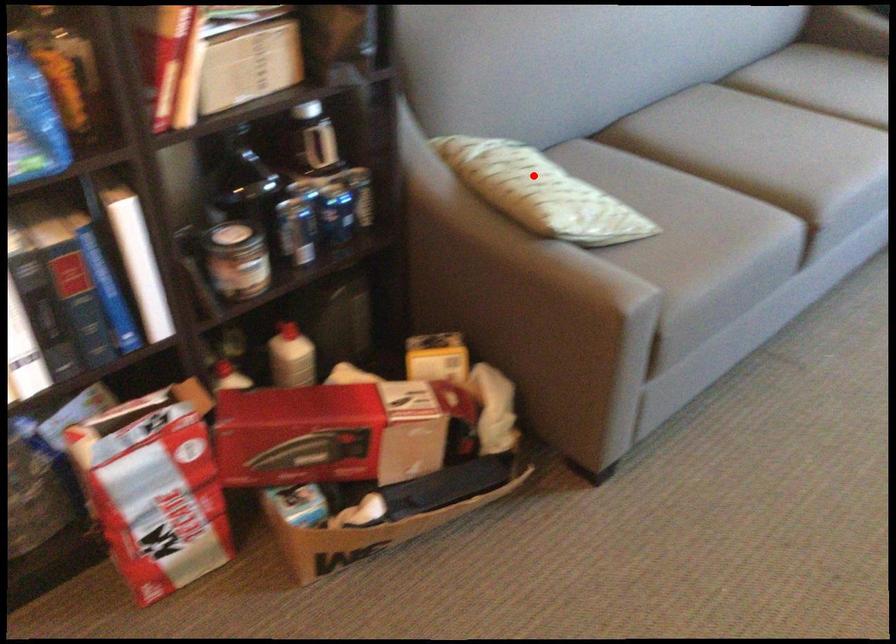
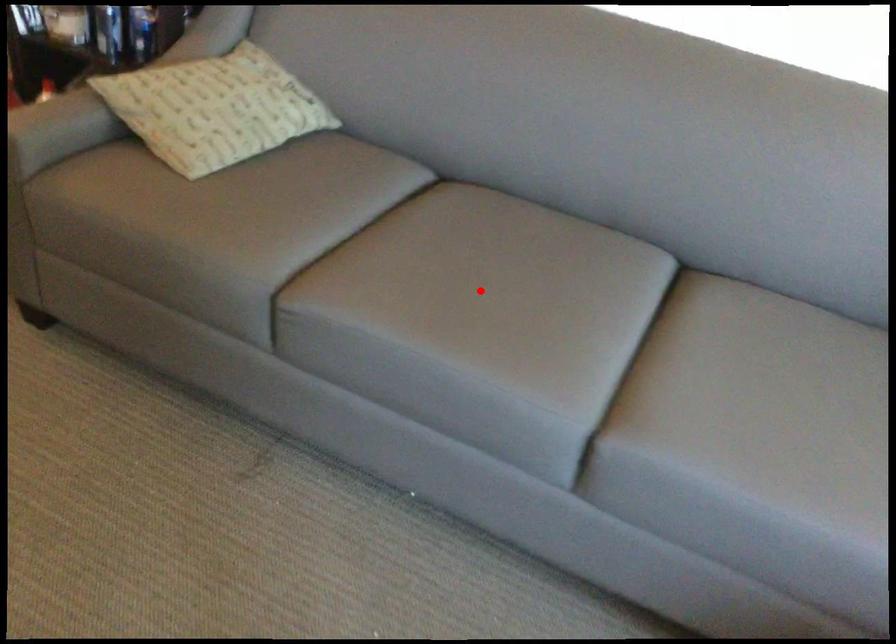
I am providing you with two images of the same scene from different viewpoints. A red point is marked on the first image and another point is marked on the second image. Are the points marked in image1 and image2 representing the same 3D position?

No